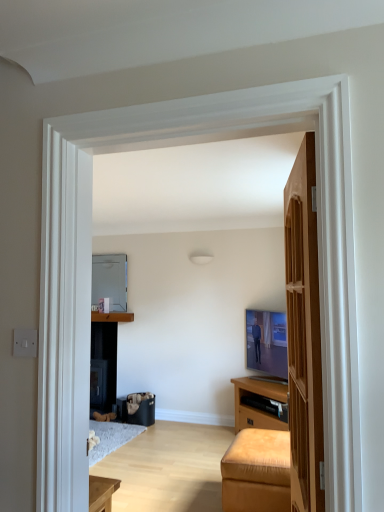
Question: Considering the relative positions of leather ottoman at lower right and wooden door at right in the image provided, is leather ottoman at lower right to the left or to the right of wooden door at right?

Choices:
 (A) right
 (B) left

Answer: (A)

Question: From their relative heights in the image, would you say leather ottoman at lower right is taller or shorter than wooden door at right?

Choices:
 (A) short
 (B) tall

Answer: (A)

Question: Considering the real-world distances, which object is farthest from the metallic refrigerator at center?

Choices:
 (A) wooden door at right
 (B) leather ottoman at lower right
 (C) matte brown cabinet at center

Answer: (A)

Question: Estimate the real-world distances between objects in this image. Which object is farther from the matte brown cabinet at center?

Choices:
 (A) metallic refrigerator at center
 (B) leather ottoman at lower right
 (C) wooden door at right

Answer: (C)